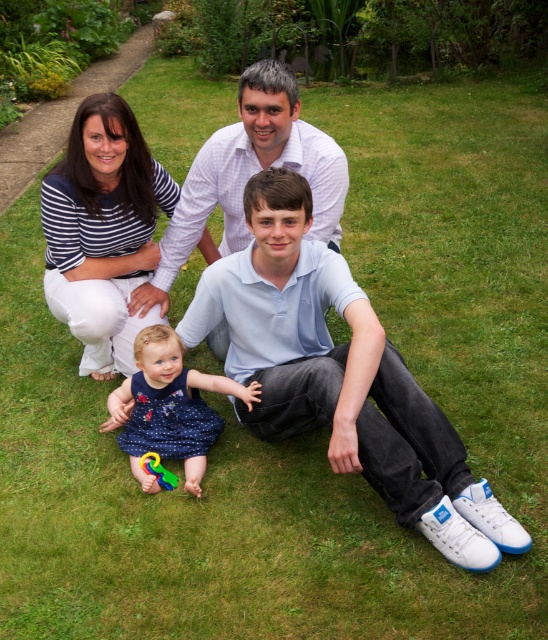
Based on the scene description, which object is larger in size between the white striped shirt at center and the dark blue satin dress at center?

The white striped shirt at center is larger in size compared to the dark blue satin dress at center according to the description.

Looking at this image, what is the 2D coordinate of the white cotton shirt at center?

The white cotton shirt at center is located at the 2D coordinate point of (340, 376).

You are a photographer trying to capture a closeup of the family. You want to ensure that both the white cotton shirt at center and the white striped shirt at center are clearly visible in the frame. Given their sizes, which shirt should you focus on to ensure it takes up more space in your photo?

The white cotton shirt at center is larger in size than the white striped shirt at center, so focusing on the white cotton shirt at center will ensure it takes up more space in the photo.